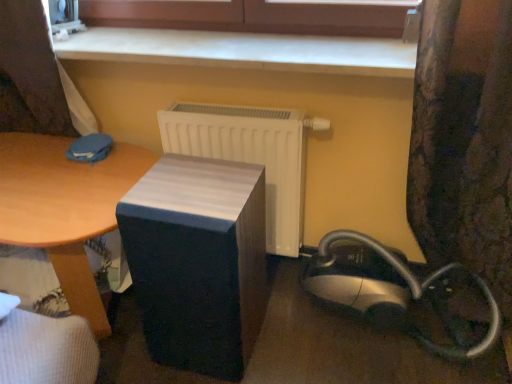
Locate an element on the screen. The height and width of the screenshot is (384, 512). free location to the left of matte black speaker at center is located at coordinates (129, 347).